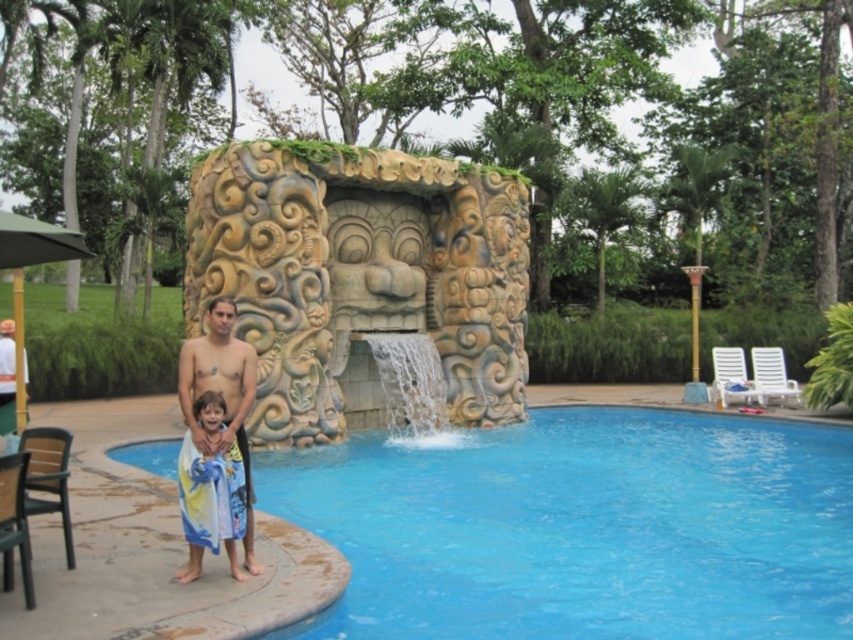
You are a photographer positioned at the edge of the pool. You want to capture a photo of the smooth tan skin at left and the smooth tan towel at center. Which object is closer to the camera?

The smooth tan skin at left is closer to the camera than the smooth tan towel at center because the smooth tan towel at center is shorter than smooth tan skin at left.

You are a photographer positioned to the left of the scene. You want to capture a photo that includes both the smooth tan towel at center and the smooth tan skin at left. Which object should you adjust your camera to focus on first to ensure both are in frame?

The smooth tan skin at left is to the left of the smooth tan towel at center, so you should focus on the smooth tan skin at left first to ensure both are in frame.